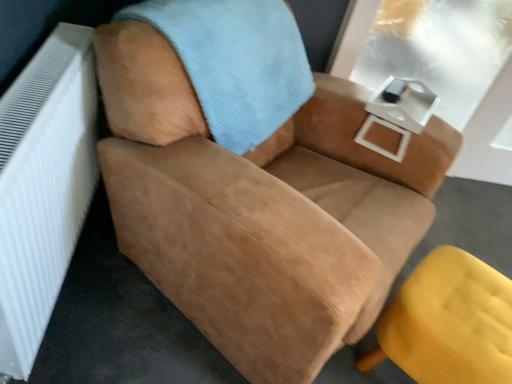
Question: Is matte yellow ottoman at lower right, which is the 2th chair from top to bottom, inside the boundaries of white glossy table at upper right, or outside?

Choices:
 (A) inside
 (B) outside

Answer: (B)

Question: Is matte yellow ottoman at lower right, which is counted as the 1th chair, starting from the bottom, wider or thinner than white glossy table at upper right?

Choices:
 (A) thin
 (B) wide

Answer: (B)

Question: Which object is the closest to the white textured radiator at left?

Choices:
 (A) light blue corduroy blanket at upper center
 (B) white glossy table at upper right
 (C) matte yellow ottoman at lower right, which is the 2th chair from top to bottom
 (D) suede tan chair at center, the 1th chair in the top-to-bottom sequence

Answer: (D)

Question: Which object is the farthest from the white glossy table at upper right?

Choices:
 (A) light blue corduroy blanket at upper center
 (B) suede tan chair at center, the 1th chair in the top-to-bottom sequence
 (C) white textured radiator at left
 (D) matte yellow ottoman at lower right, which is the 2th chair from top to bottom

Answer: (C)